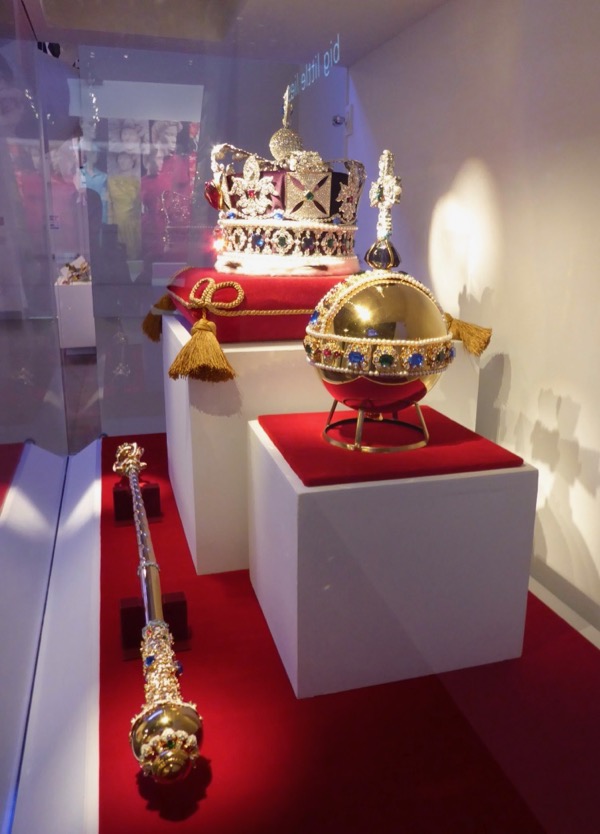
Identify the location of tassel. This screenshot has width=600, height=834. (199, 344), (162, 299), (467, 329).